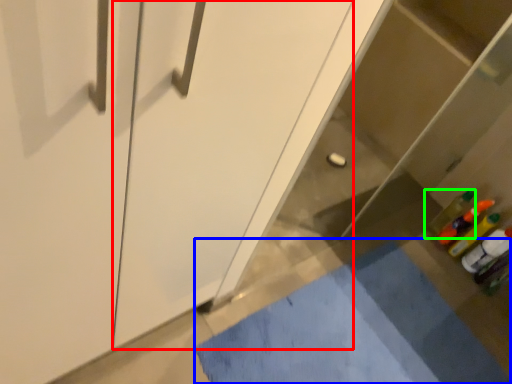
Question: Which is farther away from screen door (highlighted by a red box)? bath mat (highlighted by a blue box) or bottle (highlighted by a green box)?

Choices:
 (A) bath mat
 (B) bottle

Answer: (B)